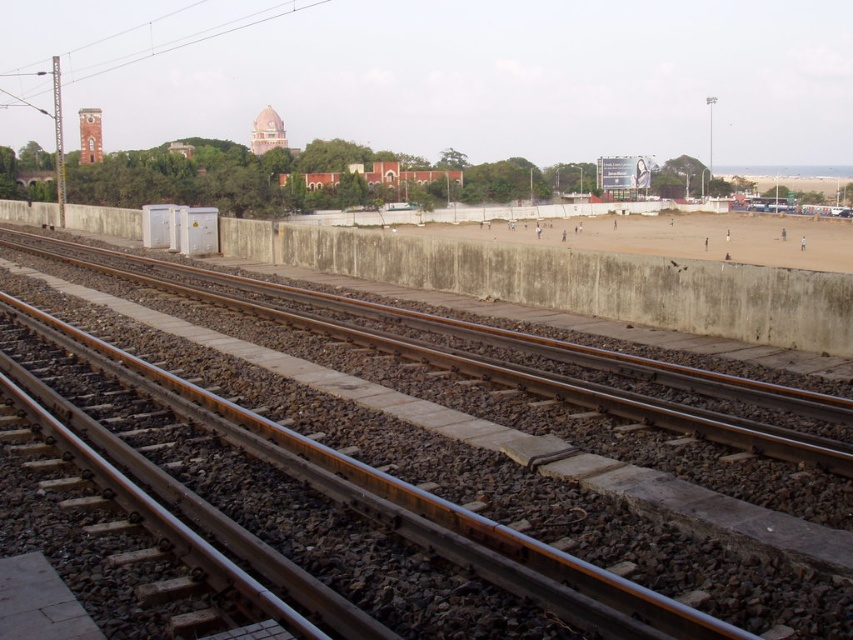
Question: Does metal at left have a greater width compared to brown sandy beach at center?

Choices:
 (A) yes
 (B) no

Answer: (B)

Question: In this image, where is metal at left located relative to brown sandy beach at center?

Choices:
 (A) above
 (B) below

Answer: (B)

Question: Is the position of metal at left less distant than that of brown sandy beach at center?

Choices:
 (A) no
 (B) yes

Answer: (B)

Question: Among these points, which one is nearest to the camera?

Choices:
 (A) (509, 449)
 (B) (799, 262)

Answer: (A)

Question: Which of the following is the farthest from the observer?

Choices:
 (A) brown sandy beach at center
 (B) metal at left

Answer: (A)